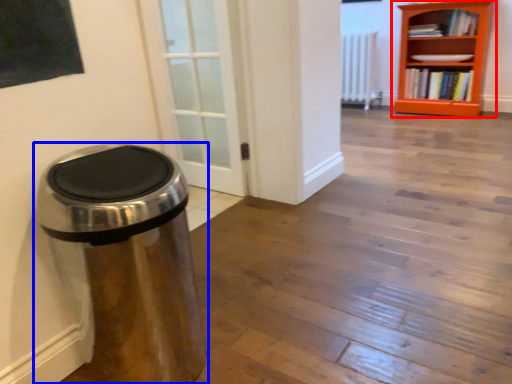
Question: Which point is further to the camera, bookcase (highlighted by a red box) or waste container (highlighted by a blue box)?

Choices:
 (A) bookcase
 (B) waste container

Answer: (A)